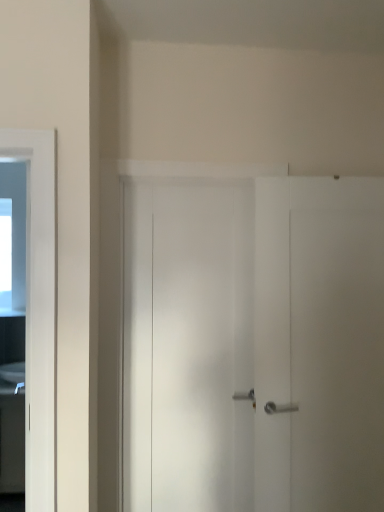
Image resolution: width=384 pixels, height=512 pixels. What do you see at coordinates (12, 444) in the screenshot?
I see `black glossy cabinet at left` at bounding box center [12, 444].

Identify the location of black glossy cabinet at left. (12, 444).

Identify the location of white glossy sink at left. Image resolution: width=384 pixels, height=512 pixels. [x=12, y=378].

What do you see at coordinates (12, 378) in the screenshot? I see `white glossy sink at left` at bounding box center [12, 378].

Locate an element on the screen. Image resolution: width=384 pixels, height=512 pixels. black glossy cabinet at left is located at coordinates (12, 444).

From the picture: Which is more to the left, white glossy sink at left or black glossy cabinet at left?

From the viewer's perspective, black glossy cabinet at left appears more on the left side.

Considering their positions, is white glossy sink at left located in front of or behind black glossy cabinet at left?

white glossy sink at left is behind black glossy cabinet at left.

Between point (19, 377) and point (14, 465), which one is positioned behind?

Positioned behind is point (19, 377).

From the image's perspective, is white glossy sink at left beneath black glossy cabinet at left?

No, from the image's perspective, white glossy sink at left is not below black glossy cabinet at left.

Based on the photo, from a real-world perspective, is white glossy sink at left over black glossy cabinet at left?

Indeed, from a real-world perspective, white glossy sink at left stands above black glossy cabinet at left.

Which of these two, white glossy sink at left or black glossy cabinet at left, is wider?

black glossy cabinet at left.

Considering the sizes of white glossy sink at left and black glossy cabinet at left in the image, is white glossy sink at left taller or shorter than black glossy cabinet at left?

Considering their sizes, white glossy sink at left has less height than black glossy cabinet at left.

Can you confirm if white glossy sink at left is smaller than black glossy cabinet at left?

Indeed, white glossy sink at left has a smaller size compared to black glossy cabinet at left.

Is white glossy sink at left not within black glossy cabinet at left?

white glossy sink at left is positioned outside black glossy cabinet at left.

Can you see white glossy sink at left touching black glossy cabinet at left?

No, white glossy sink at left is not in contact with black glossy cabinet at left.

Does white glossy sink at left turn towards black glossy cabinet at left?

No, white glossy sink at left does not turn towards black glossy cabinet at left.

How many degrees apart are the facing directions of white glossy sink at left and black glossy cabinet at left?

There is a 0.00212-degree angle between the facing directions of white glossy sink at left and black glossy cabinet at left.

Where is `sink behind the black glossy cabinet at left`? sink behind the black glossy cabinet at left is located at coordinates (12, 378).

Considering the relative positions of black glossy cabinet at left and white glossy sink at left in the image provided, is black glossy cabinet at left to the left or to the right of white glossy sink at left?

Based on their positions, black glossy cabinet at left is located to the left of white glossy sink at left.

Is black glossy cabinet at left positioned behind white glossy sink at left?

No.

Considering the positions of points (10, 397) and (11, 383), is point (10, 397) closer to camera compared to point (11, 383)?

That is True.

From the image's perspective, would you say black glossy cabinet at left is positioned over white glossy sink at left?

No, from the image's perspective, black glossy cabinet at left is not over white glossy sink at left.

From a real-world perspective, is black glossy cabinet at left located higher than white glossy sink at left?

No, from a real-world perspective, black glossy cabinet at left is not on top of white glossy sink at left.

Which of these two, black glossy cabinet at left or white glossy sink at left, is thinner?

white glossy sink at left.

Considering the relative sizes of black glossy cabinet at left and white glossy sink at left in the image provided, is black glossy cabinet at left shorter than white glossy sink at left?

In fact, black glossy cabinet at left may be taller than white glossy sink at left.

Who is smaller, black glossy cabinet at left or white glossy sink at left?

white glossy sink at left.

Is black glossy cabinet at left inside the boundaries of white glossy sink at left, or outside?

black glossy cabinet at left exists outside the volume of white glossy sink at left.

Are black glossy cabinet at left and white glossy sink at left making contact?

No, black glossy cabinet at left is not next to white glossy sink at left.

Is black glossy cabinet at left turned away from white glossy sink at left?

That's not correct — black glossy cabinet at left is not looking away from white glossy sink at left.

Can you tell me how much black glossy cabinet at left and white glossy sink at left differ in facing direction?

There is a 0.00212-degree angle between the facing directions of black glossy cabinet at left and white glossy sink at left.

How distant is black glossy cabinet at left from white glossy sink at left?

black glossy cabinet at left and white glossy sink at left are 12.49 inches apart from each other.

Image resolution: width=384 pixels, height=512 pixels. In order to click on sink on the right of black glossy cabinet at left in this screenshot , I will do `click(12, 378)`.

Find the location of `cabinetry lying on the left of white glossy sink at left`. cabinetry lying on the left of white glossy sink at left is located at coordinates (12, 444).

In the image, there is a white glossy sink at left. Where is `cabinetry below it (from a real-world perspective)`? This screenshot has width=384, height=512. cabinetry below it (from a real-world perspective) is located at coordinates (12, 444).